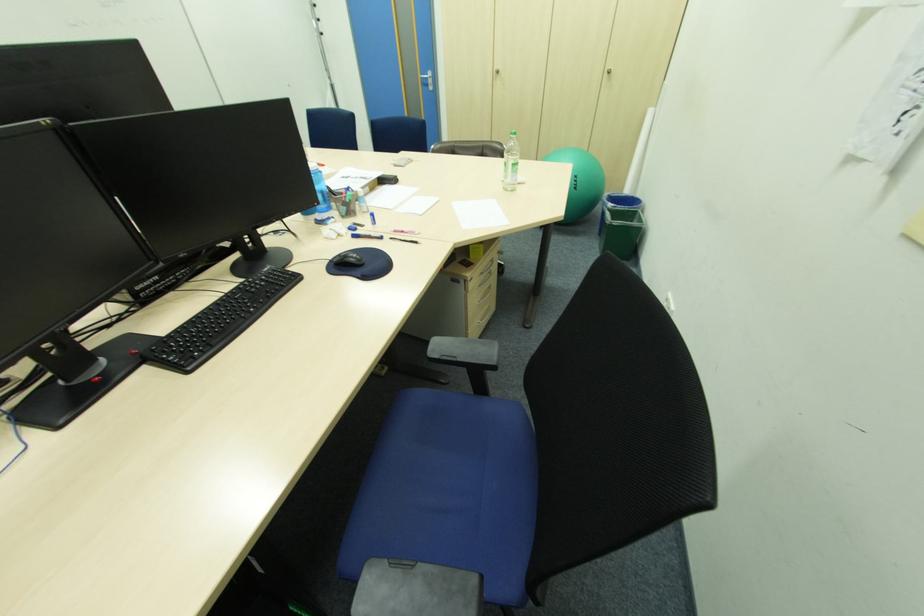
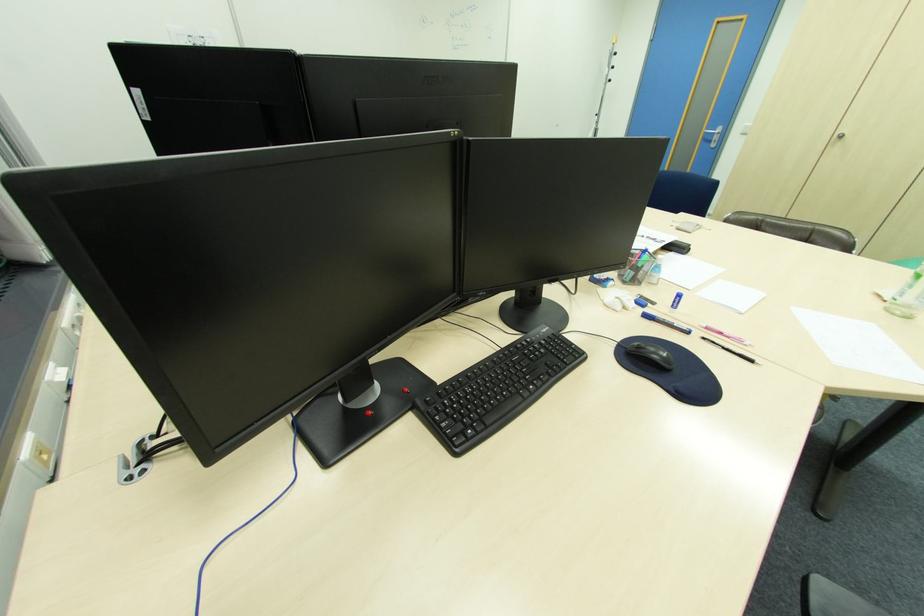
Locate, in the second image, the point that corresponds to (x=349, y=209) in the first image.

(637, 274)